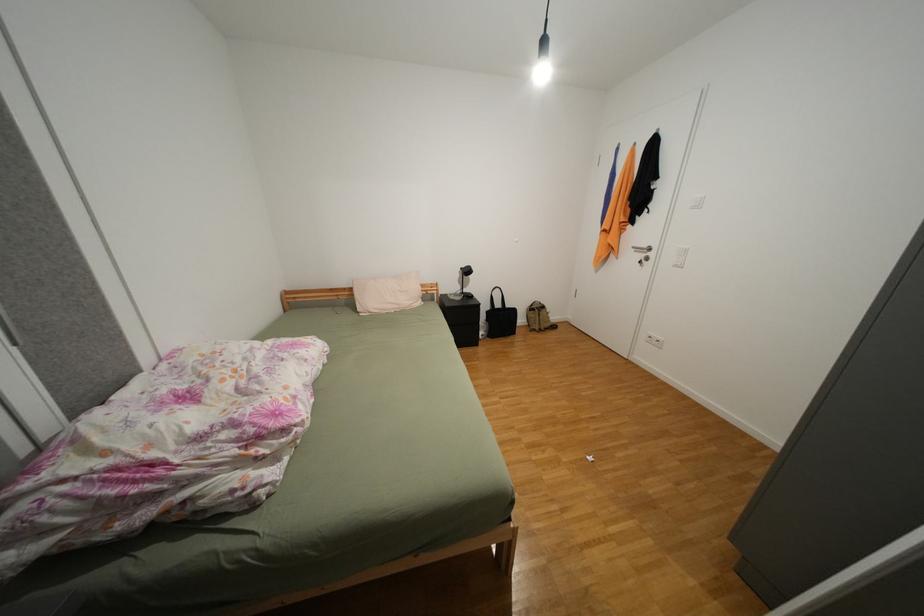
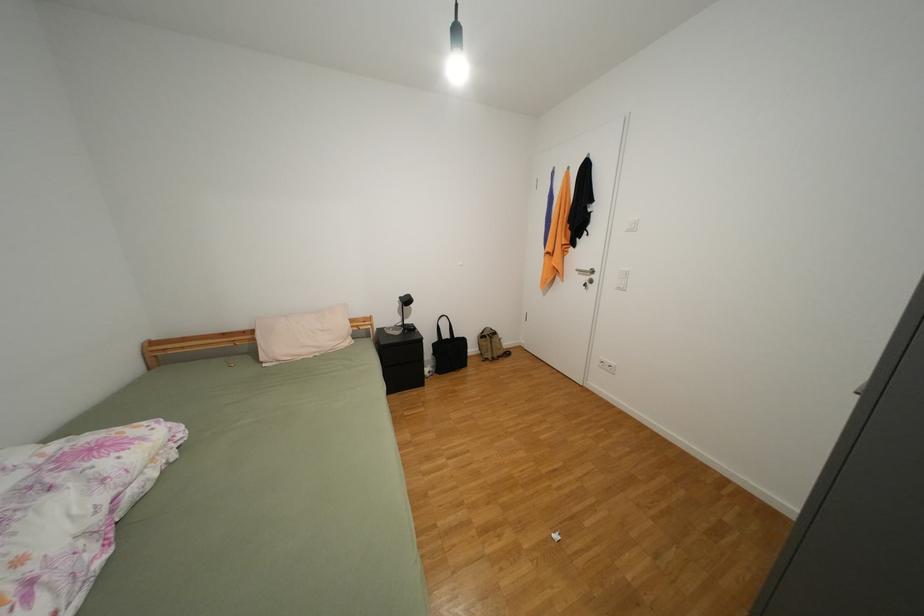
Question: The camera is either moving clockwise (left) or counter-clockwise (right) around the object. The first image is from the beginning of the video and the second image is from the end. Is the camera moving left or right when shooting the video?

Choices:
 (A) Left
 (B) Right

Answer: (A)